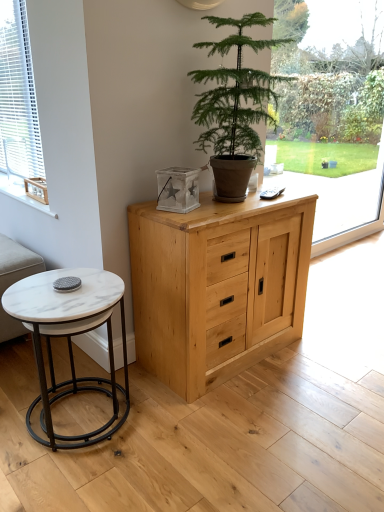
Find the location of a particular element. This screenshot has height=512, width=384. blank area beneath green leafy plant at center (from a real-world perspective) is located at coordinates (241, 206).